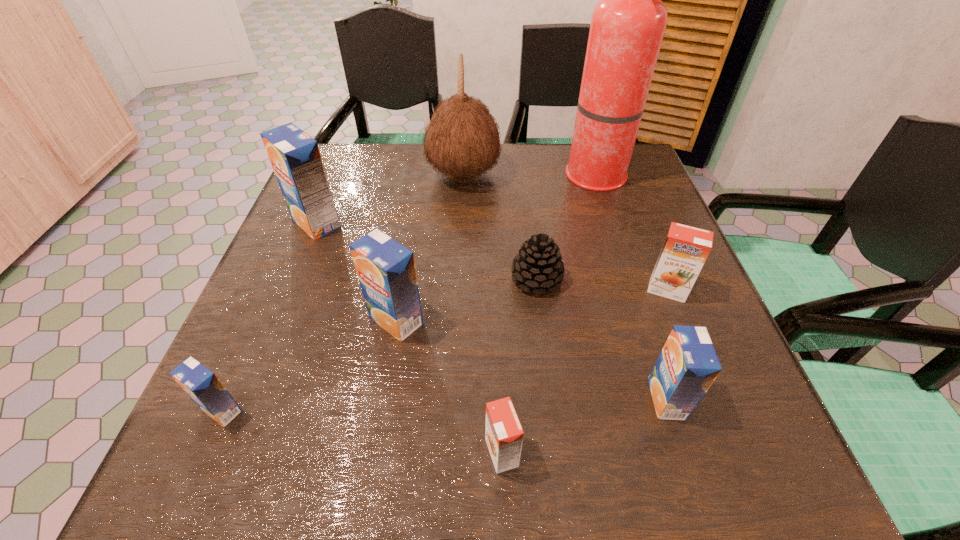
Find the location of a particular element. red fire extinguisher is located at coordinates (627, 27).

You are a GUI agent. You are given a task and a screenshot of the screen. Output one action in this format:
    pyautogui.click(x=<x>, y=<y>)
    Task: Click on the fire extinguisher
    
    Given the screenshot: What is the action you would take?
    pyautogui.click(x=627, y=27)

You are a GUI agent. You are given a task and a screenshot of the screen. Output one action in this format:
    pyautogui.click(x=<x>, y=<y>)
    Task: Click on the eighth shortest object
    This screenshot has width=960, height=540.
    Given the screenshot: What is the action you would take?
    pyautogui.click(x=462, y=140)

At what (x,y) coordinates should I click in order to perform the action: click on the farthest blue orange_juice. Please return your answer as a coordinate pair (x, y). This screenshot has height=540, width=960. Looking at the image, I should click on (294, 155).

This screenshot has width=960, height=540. Find the location of `the tallest orange juice`. the tallest orange juice is located at coordinates (294, 155).

At what (x,y) coordinates should I click in order to perform the action: click on the second biggest blue orange_juice. Please return your answer as a coordinate pair (x, y). Image resolution: width=960 pixels, height=540 pixels. Looking at the image, I should click on (386, 271).

Where is `the third blue orange_juice from left to right`? The width and height of the screenshot is (960, 540). the third blue orange_juice from left to right is located at coordinates (386, 271).

This screenshot has width=960, height=540. What are the coordinates of `the farther orange orange juice` in the screenshot? It's located at (685, 250).

Where is `the rightmost orange juice`? Image resolution: width=960 pixels, height=540 pixels. the rightmost orange juice is located at coordinates (685, 250).

Identify the location of the second orange juice from right to left. The width and height of the screenshot is (960, 540). (687, 366).